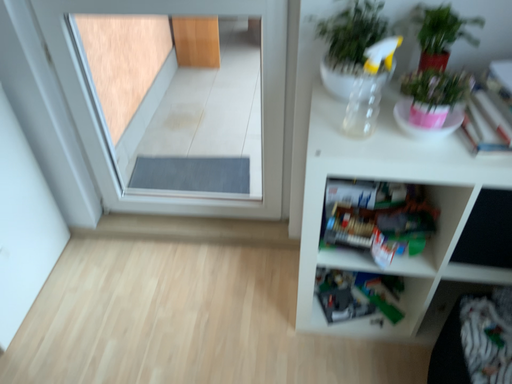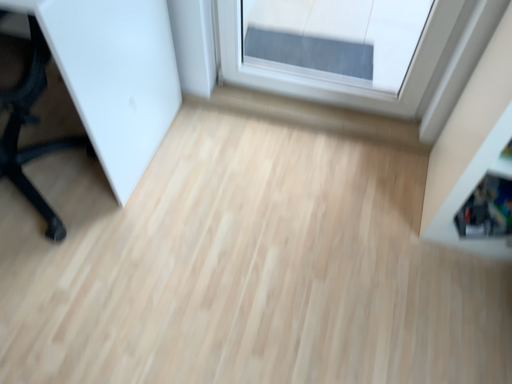
Question: Which way did the camera rotate in the video?

Choices:
 (A) rotated left
 (B) rotated right

Answer: (A)